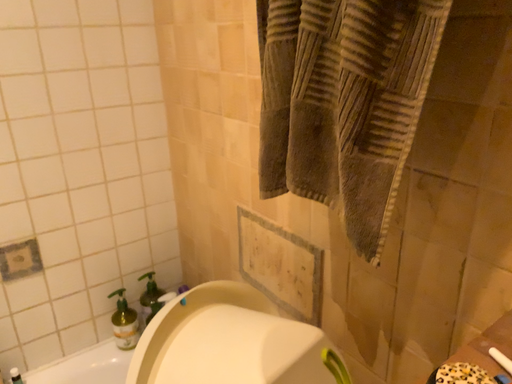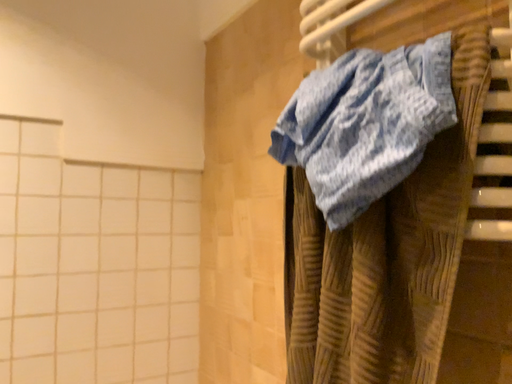
Question: How did the camera likely rotate when shooting the video?

Choices:
 (A) rotated downward
 (B) rotated upward

Answer: (B)